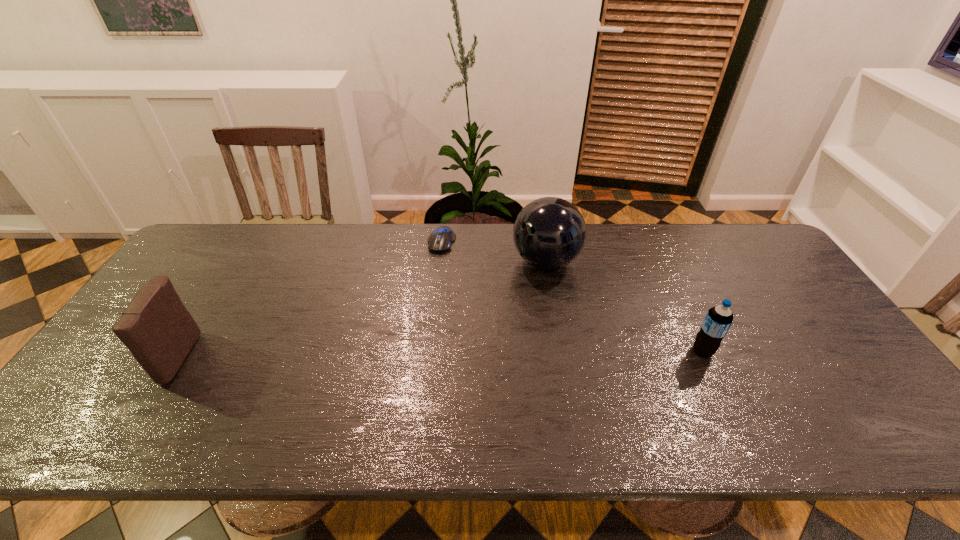
The width and height of the screenshot is (960, 540). In order to click on free space between the bowling ball and the third object from right to left in this screenshot , I will do `click(493, 252)`.

Find the location of `empty location between the leftmost object and the second object from right to left`. empty location between the leftmost object and the second object from right to left is located at coordinates (360, 309).

Where is `vacant space that is in between the shortest object and the leftmost object`? The image size is (960, 540). vacant space that is in between the shortest object and the leftmost object is located at coordinates (308, 300).

This screenshot has width=960, height=540. What are the coordinates of `object identified as the third closest to the second shortest object` in the screenshot? It's located at 156,327.

Locate an element on the screen. The image size is (960, 540). object that is the third closest to the soda bottle is located at coordinates (156, 327).

You are a GUI agent. You are given a task and a screenshot of the screen. Output one action in this format:
    pyautogui.click(x=<x>, y=<y>)
    Task: Click on the vacant space that satisfies the following two spatial constraints: 1. on the front side of the computer mouse; 2. on the right side of the third tallest object
    The image size is (960, 540).
    Given the screenshot: What is the action you would take?
    pyautogui.click(x=430, y=351)

In order to click on free point that satisfies the following two spatial constraints: 1. on the front side of the third tallest object; 2. on the left side of the second object from right to left in this screenshot , I will do `click(562, 351)`.